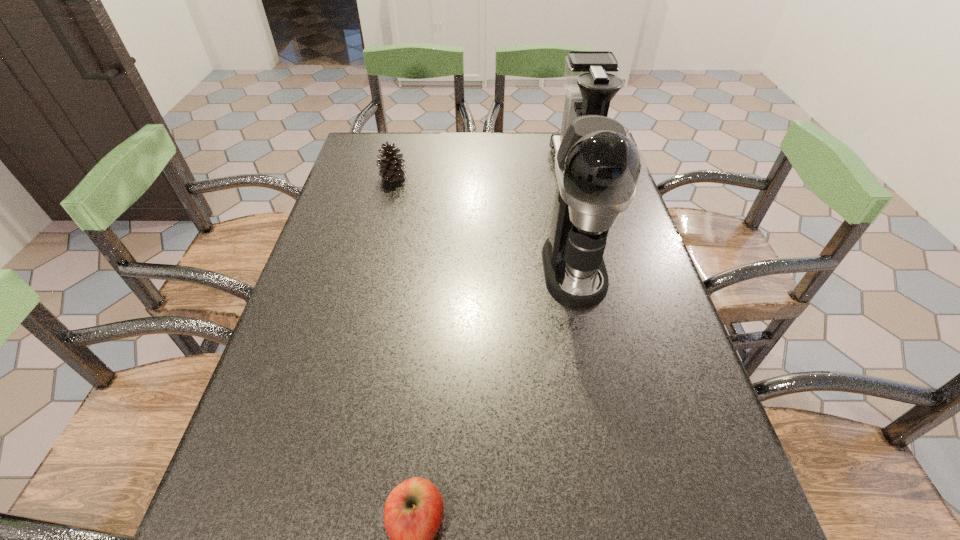
At what (x,y) coordinates should I click in order to perform the action: click on the third farthest object. Please return your answer as a coordinate pair (x, y). The height and width of the screenshot is (540, 960). Looking at the image, I should click on (597, 167).

At what (x,y) coordinates should I click in order to perform the action: click on the nearer coffee maker. Please return your answer as a coordinate pair (x, y). This screenshot has height=540, width=960. Looking at the image, I should click on (597, 167).

At what (x,y) coordinates should I click in order to perform the action: click on the second tallest object. Please return your answer as a coordinate pair (x, y). The image size is (960, 540). Looking at the image, I should click on (591, 81).

Where is `the farther coffee maker`? Image resolution: width=960 pixels, height=540 pixels. the farther coffee maker is located at coordinates (591, 81).

The height and width of the screenshot is (540, 960). In order to click on the leftmost object in this screenshot , I will do `click(392, 169)`.

Locate an element on the screen. The height and width of the screenshot is (540, 960). the second shortest object is located at coordinates (392, 169).

Image resolution: width=960 pixels, height=540 pixels. What are the coordinates of `free region located 0.390m place cup under the spout of the nearer coffee maker` in the screenshot? It's located at (622, 501).

I want to click on free space located 0.120m at the front of the shorter coffee maker where the controls are located, so click(x=512, y=168).

At what (x,y) coordinates should I click in order to perform the action: click on free space located at the front of the shorter coffee maker where the controls are located. Please return your answer as a coordinate pair (x, y). Looking at the image, I should click on (425, 168).

You are a GUI agent. You are given a task and a screenshot of the screen. Output one action in this format:
    pyautogui.click(x=<x>, y=<y>)
    Task: Click on the free point located at the front of the shorter coffee maker where the controls are located
    The image size is (960, 540).
    Given the screenshot: What is the action you would take?
    pyautogui.click(x=425, y=168)